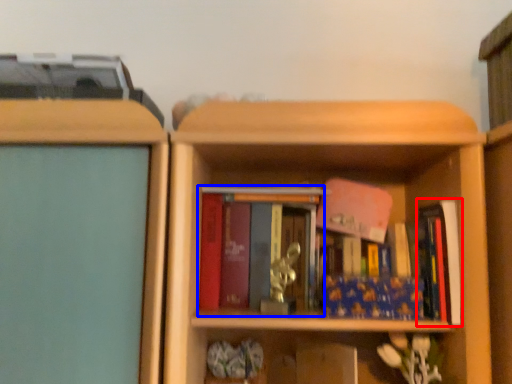
Question: Which of the following is the closest to the observer, book (highlighted by a red box) or book (highlighted by a blue box)?

Choices:
 (A) book
 (B) book

Answer: (A)